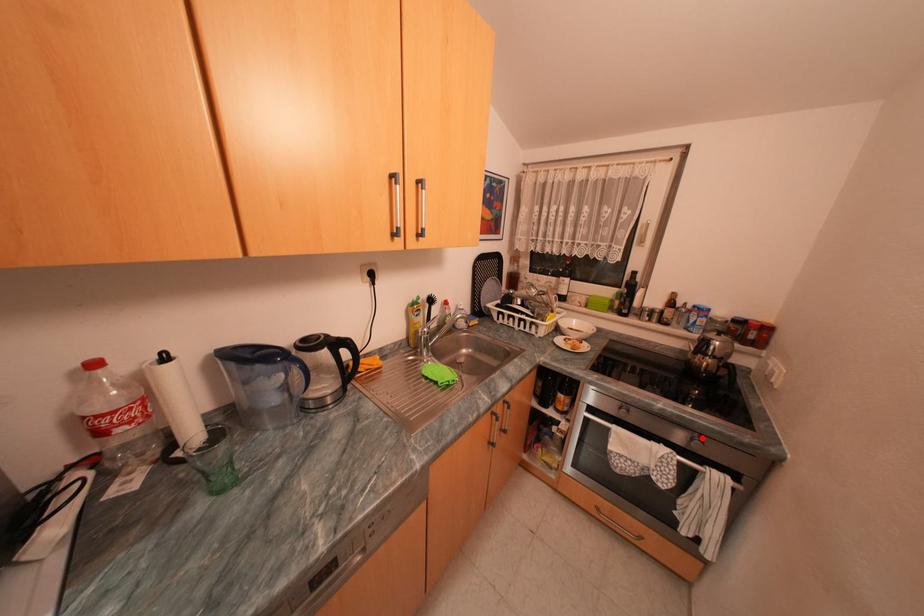
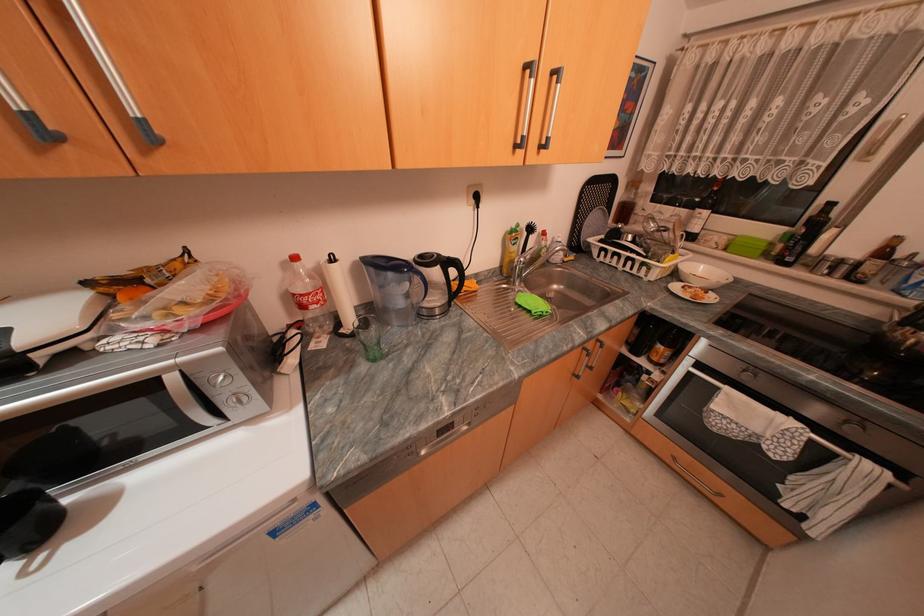
Locate, in the second image, the point that corresponds to the highlighted location in the first image.

(857, 421)